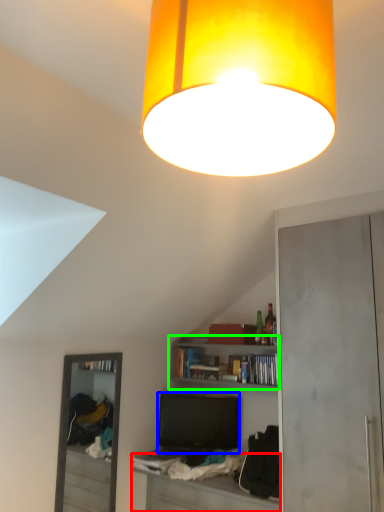
Question: Which object is the closest to the table (highlighted by a red box)? Choose among these: television (highlighted by a blue box) or shelf (highlighted by a green box).

Choices:
 (A) television
 (B) shelf

Answer: (A)